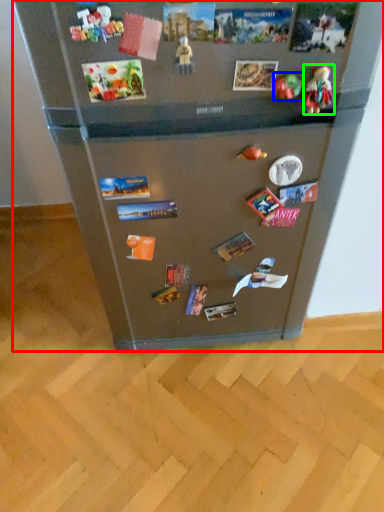
Question: Based on their relative distances, which object is farther from refrigerator (highlighted by a red box)? Choose from toy (highlighted by a blue box) and toy (highlighted by a green box).

Choices:
 (A) toy
 (B) toy

Answer: (B)